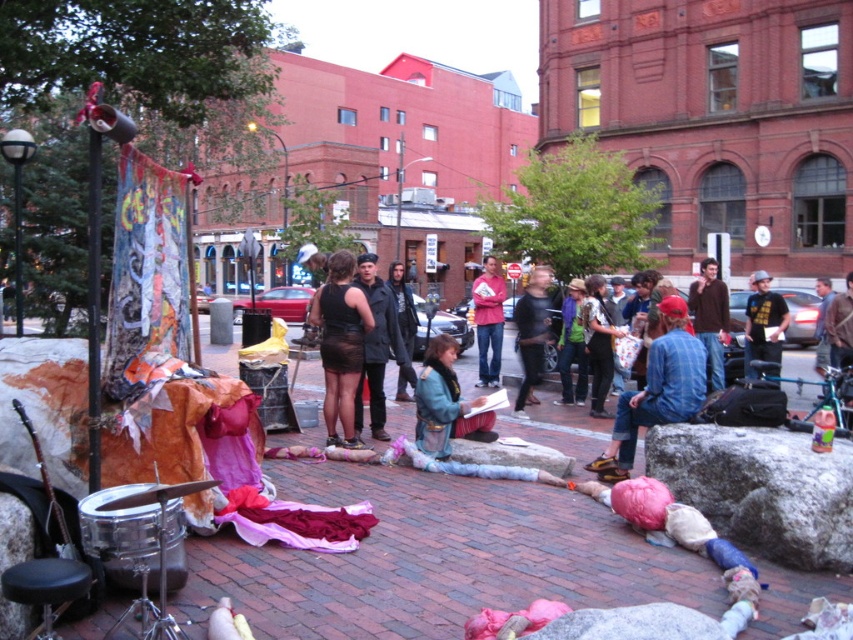
You are organizing a small fashion show in the plaza and need to display two garments on a mannequin. The black sheer skirt at center and the dark gray wool coat at center are available. If you want to ensure that both garments can fit side by side on the same mannequin without overlapping, which garment should you place closer to the edge to accommodate their widths?

The black sheer skirt at center has a smaller width compared to the dark gray wool coat at center. To fit both garments side by side without overlapping, place the black sheer skirt at center closer to the edge since it requires less space.